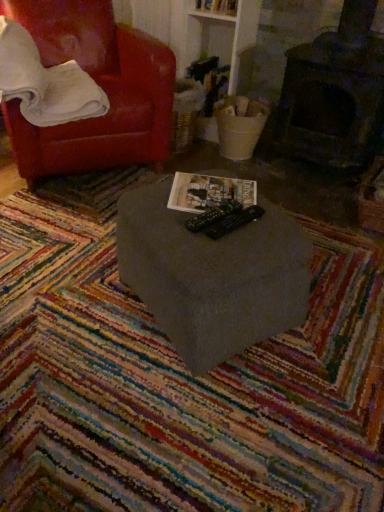
I want to click on vacant area to the left of matte gray table at center, so click(74, 297).